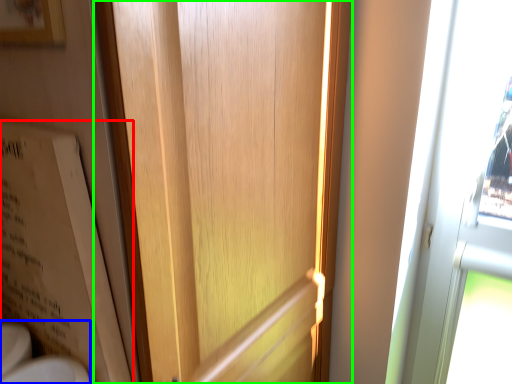
Question: Considering the real-world distances, which object is farthest from bulletin board (highlighted by a red box)? sink (highlighted by a blue box) or door (highlighted by a green box)?

Choices:
 (A) sink
 (B) door

Answer: (B)